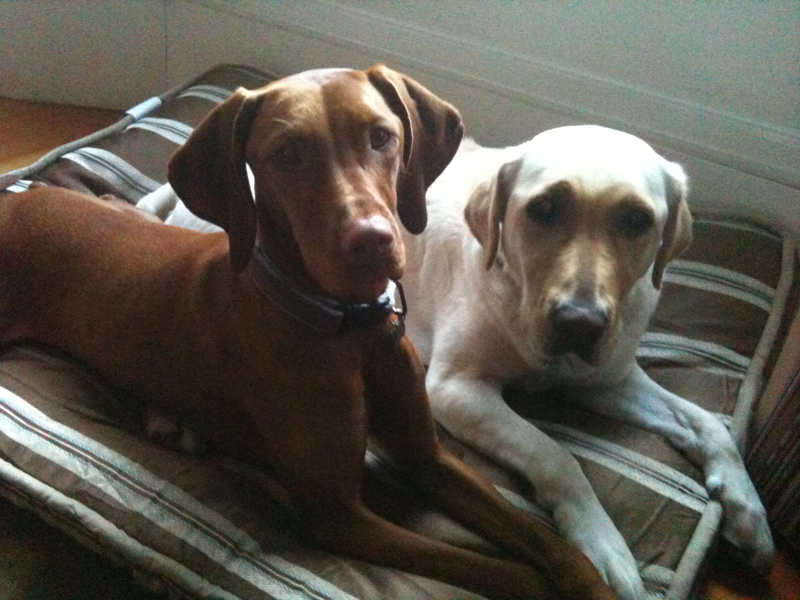
This screenshot has width=800, height=600. Find the location of `white and brown stripes on pillow`. white and brown stripes on pillow is located at coordinates (142, 504).